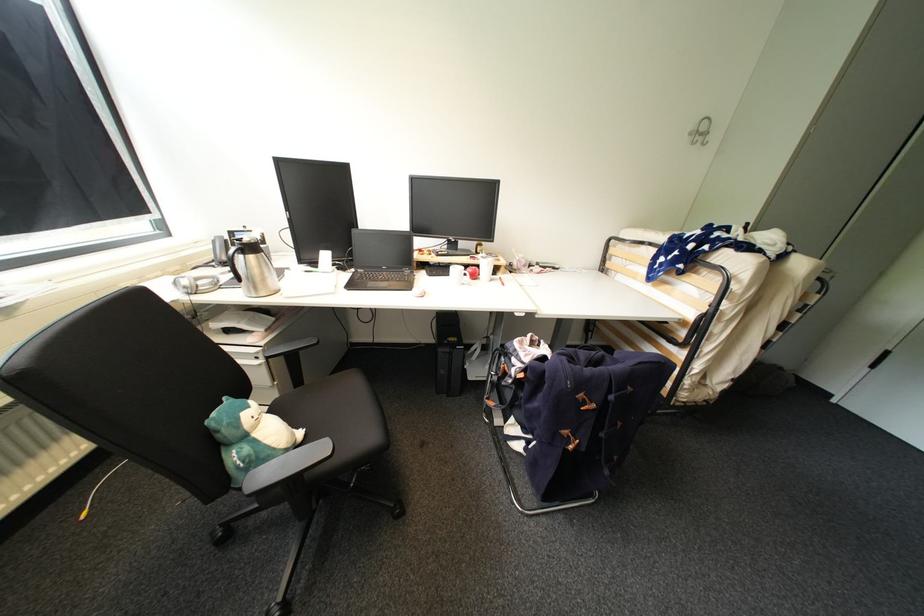
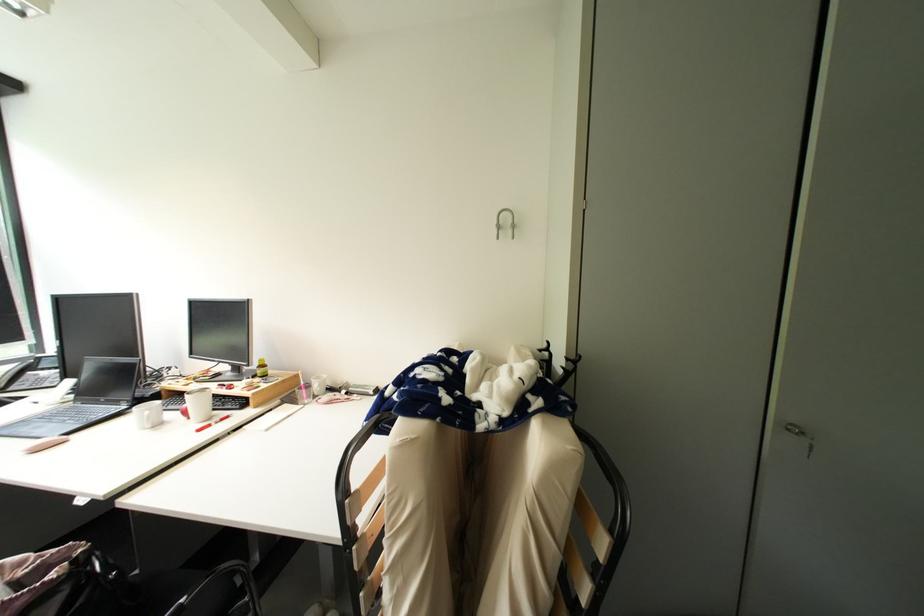
Question: What movement of the cameraman would produce the second image?

Choices:
 (A) Left
 (B) Right
 (C) Forward
 (D) Backward

Answer: (B)